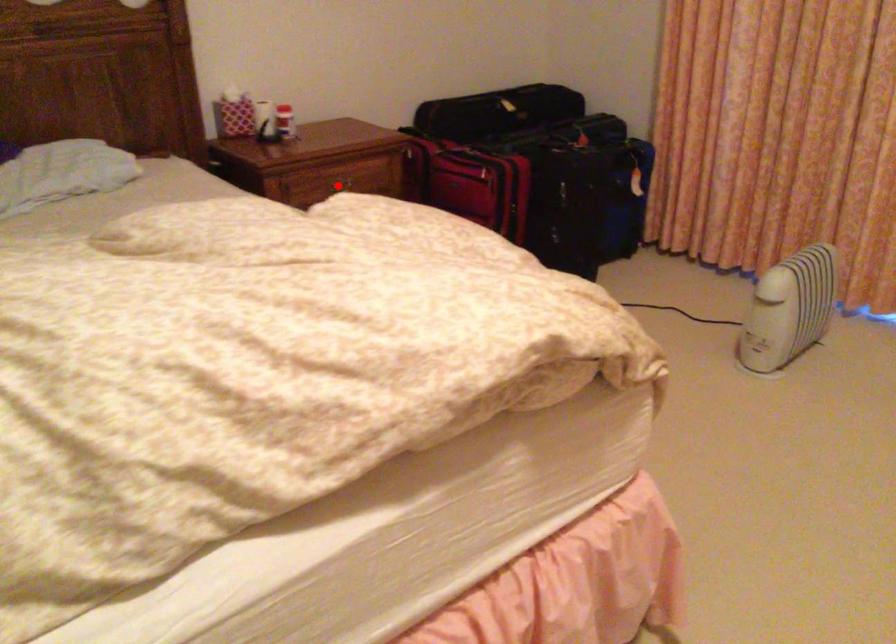
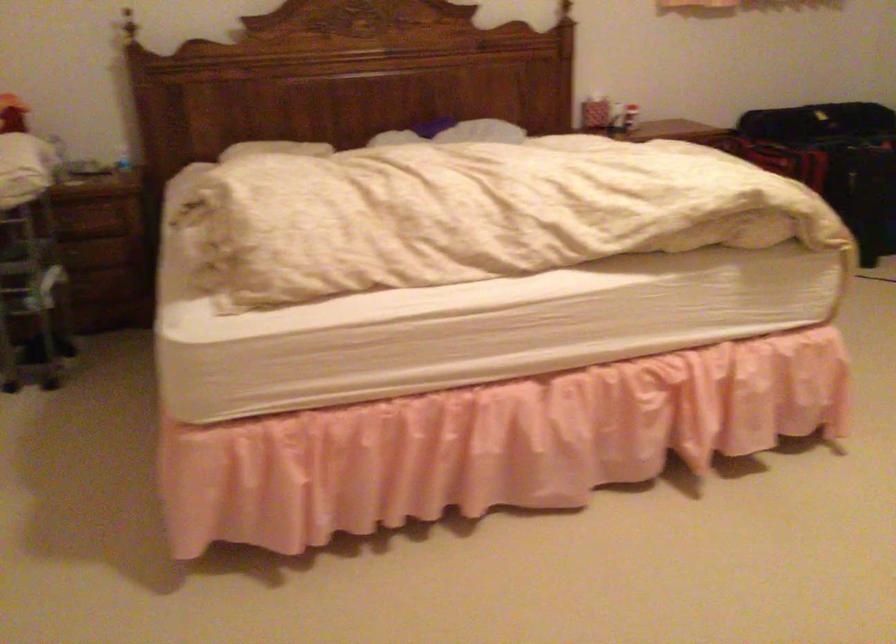
Question: I am providing you with two images of the same scene from different viewpoints. A red point is marked on the first image. Is the red point's position out of view in image 2?

Choices:
 (A) Yes
 (B) No

Answer: (A)